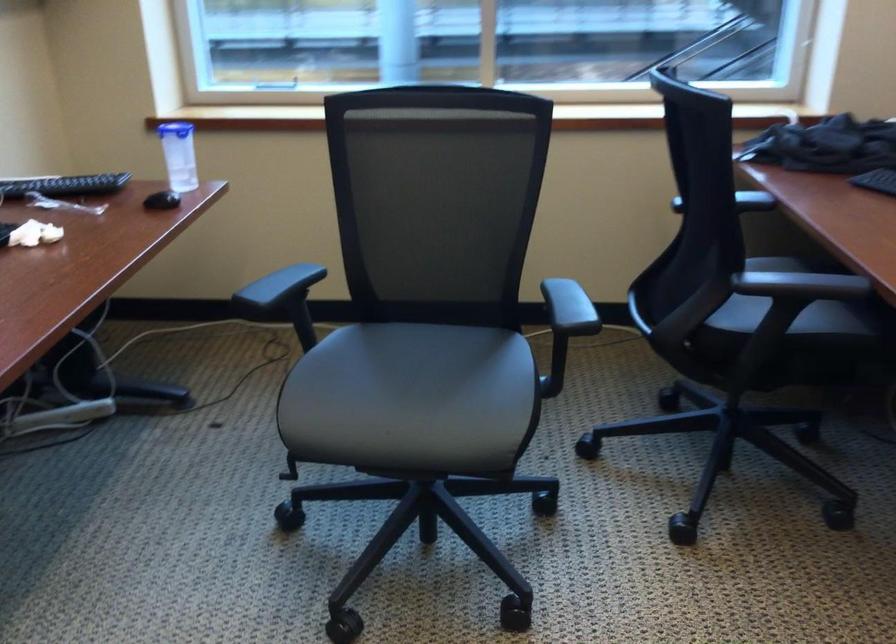
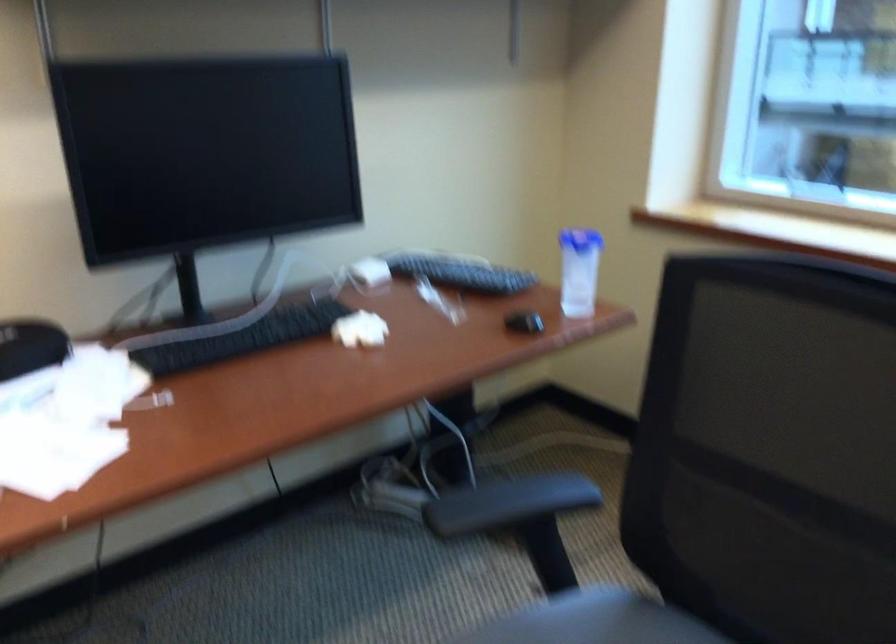
Find the pixel in the second image that matches (354,330) in the first image.

(593, 621)